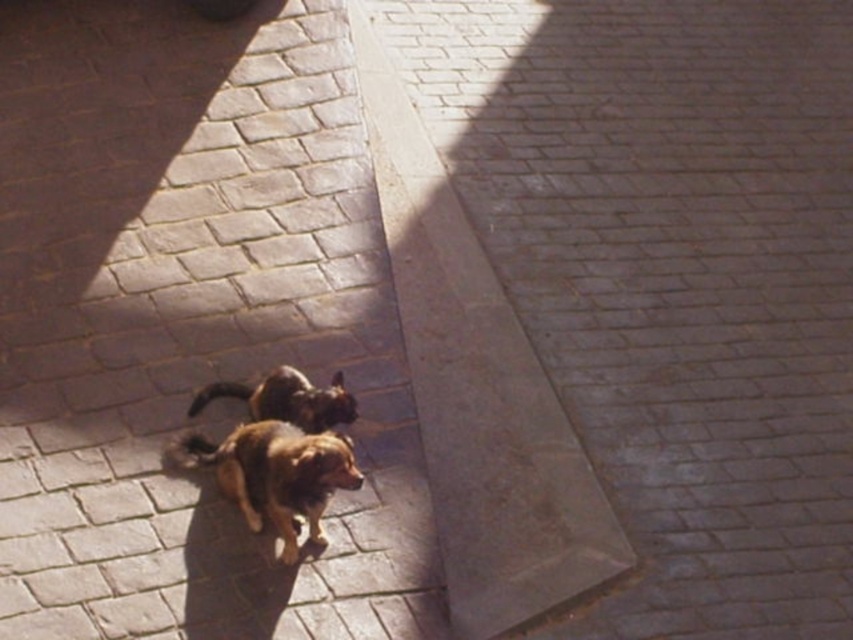
You are a delivery robot that is 1.5 meters wide. You are on the paved area and need to move from the brown fur dog at center to the cat behind it. The distance between them is 4.59 meters. Can you navigate through the space between them without any obstacles?

The distance between the brown fur dog at center and the cat behind it is 4.59 meters. Since the robot is 1.5 meters wide, it can navigate through the space as the distance is sufficient for movement.

You are a photographer trying to capture the brown fur dog at center and the brown furry dog at center in a single shot. However, you notice that one of them is blocking the other. Which dog is currently obscuring the view of the other?

The brown fur dog at center is positioned under the brown furry dog at center, so the brown furry dog at center is blocking the view of the brown fur dog at center.

You are standing on the paved area and want to walk from point A to point B. The two points are labeled as point (x=517, y=202) and point (x=262, y=451). Which point should you start from to be closer to your starting position?

You should start from point (x=517, y=202) because it is closer to the viewer than point (x=262, y=451).